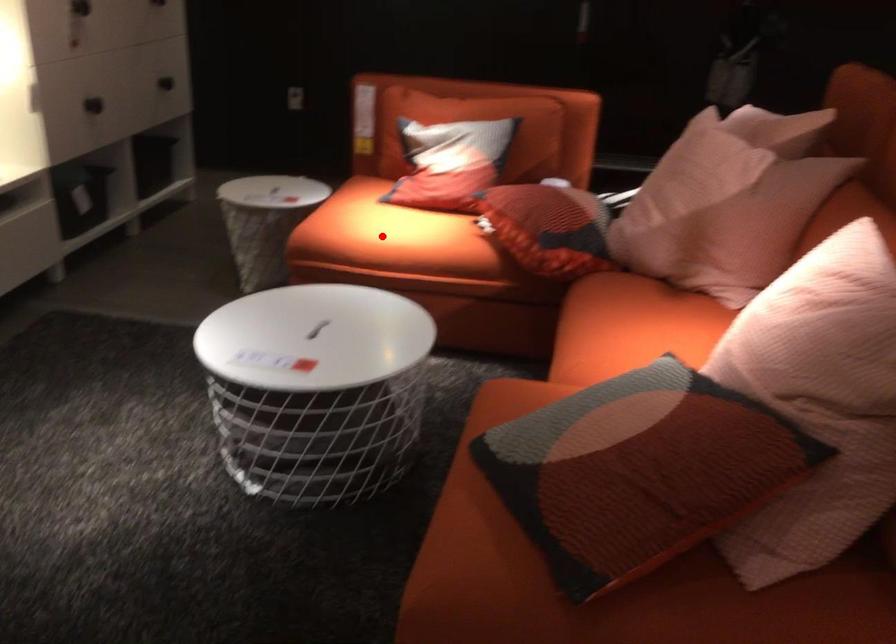
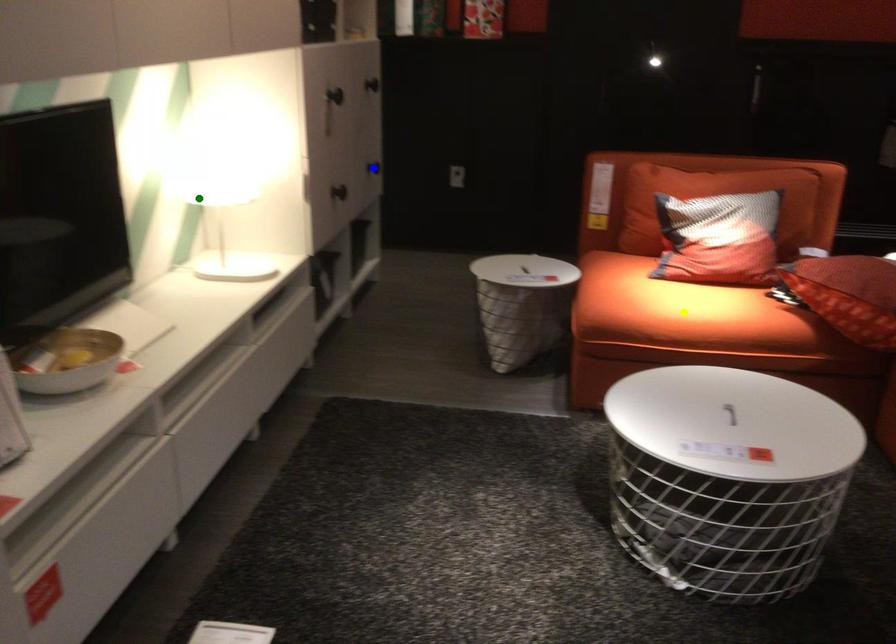
Question: I am providing you with two images of the same scene from different viewpoints. A red point is marked on the first image. You are given multiple points on the second image. In image 2, which mark is for the same physical point as the one in image 1?

Choices:
 (A) yellow point
 (B) blue point
 (C) green point

Answer: (A)